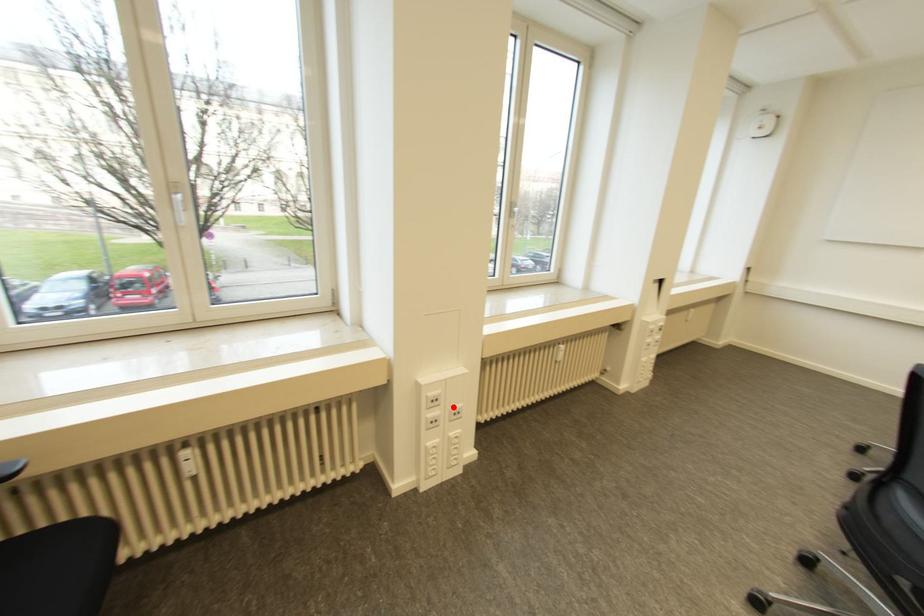
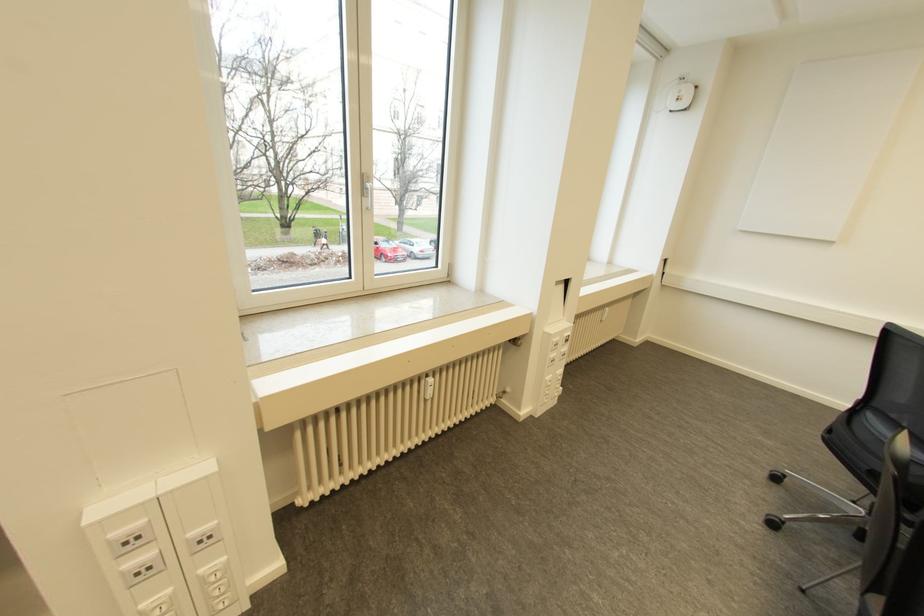
Question: I am providing you with two images of the same scene from different viewpoints. A red point is marked on the first image. Can you still see the location of the red point in image 2?

Choices:
 (A) Yes
 (B) No

Answer: (A)